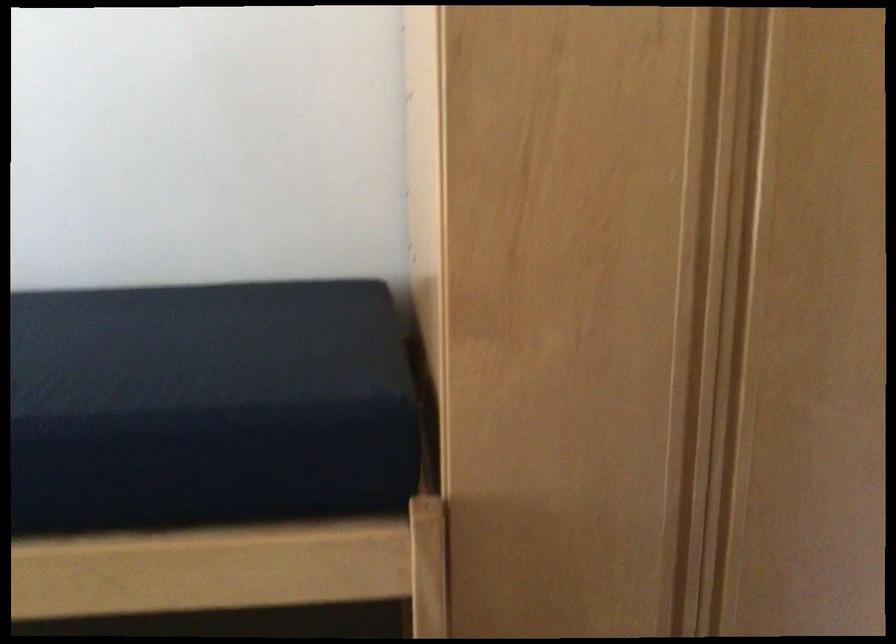
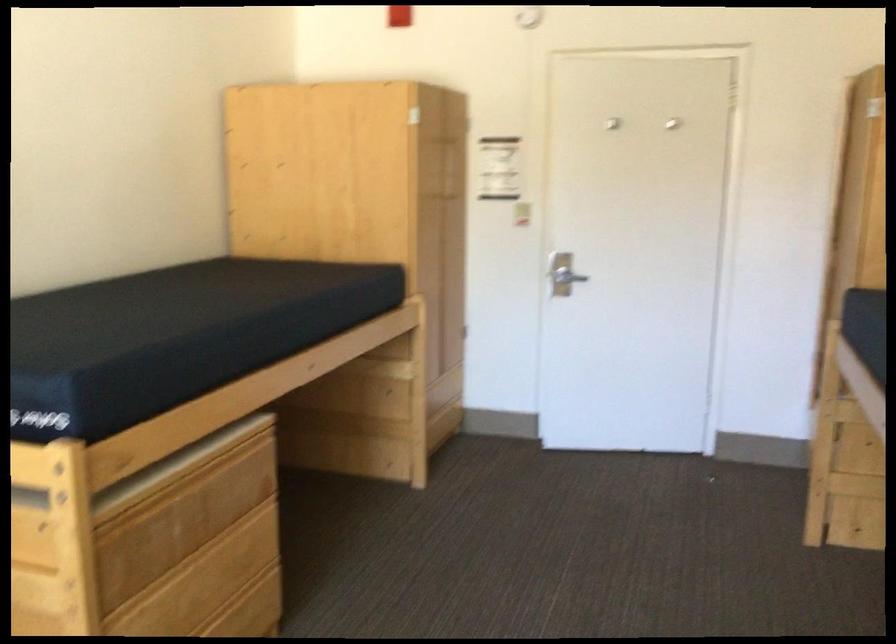
Locate, in the second image, the point that corresponds to (202,346) in the first image.

(314, 261)